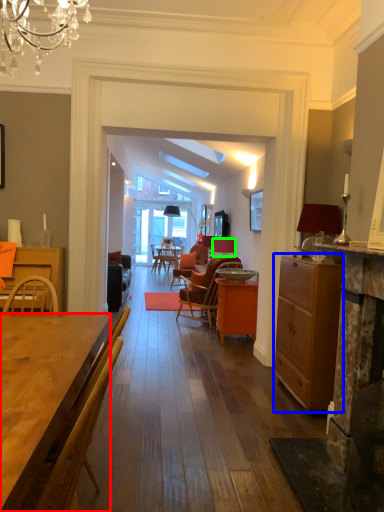
Question: Based on their relative distances, which object is nearer to desk (highlighted by a red box)? Choose from cabinetry (highlighted by a blue box) and loudspeaker (highlighted by a green box).

Choices:
 (A) cabinetry
 (B) loudspeaker

Answer: (A)